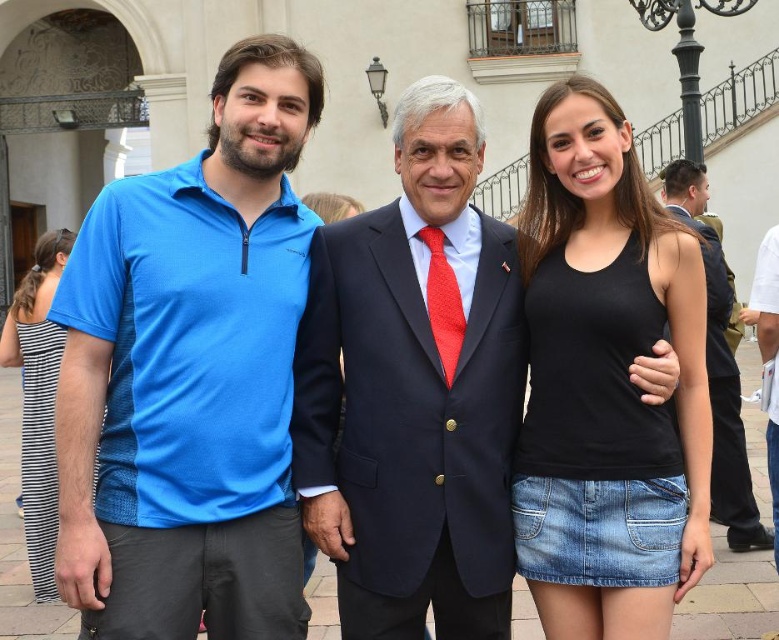
Does blue fabric shirt at center have a lesser width compared to navy blue suit at center?

No.

From the picture: Does blue fabric shirt at center have a lesser height compared to navy blue suit at center?

No, blue fabric shirt at center is not shorter than navy blue suit at center.

At what (x,y) coordinates should I click in order to perform the action: click on blue fabric shirt at center. Please return your answer as a coordinate pair (x, y). Looking at the image, I should click on (189, 374).

Measure the distance between black matte tank top at center and black cotton suit at center.

They are 7.91 meters apart.

Between black matte tank top at center and black cotton suit at center, which one appears on the left side from the viewer's perspective?

black matte tank top at center is more to the left.

What are the coordinates of `black matte tank top at center` in the screenshot? It's located at (607, 368).

Does blue fabric shirt at center appear over white cotton shirt at right?

Correct, blue fabric shirt at center is located above white cotton shirt at right.

From the picture: Who is shorter, blue fabric shirt at center or white cotton shirt at right?

Standing shorter between the two is white cotton shirt at right.

Locate an element on the screen. The height and width of the screenshot is (640, 779). blue fabric shirt at center is located at coordinates (189, 374).